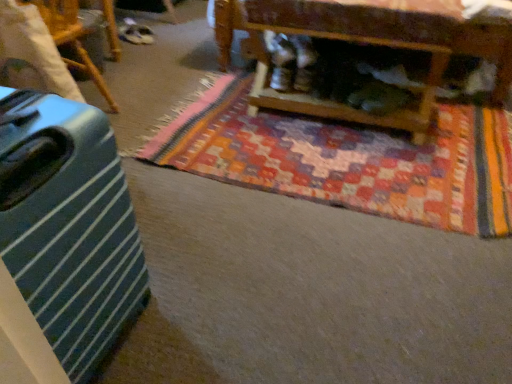
What is the approximate width of wooden coffee table at upper center, the first furniture when ordered from right to left?

wooden coffee table at upper center, the first furniture when ordered from right to left, is 16.58 inches in width.

Where is `green striped suitcase at left`? Image resolution: width=512 pixels, height=384 pixels. green striped suitcase at left is located at coordinates (69, 226).

Is multicolored woven mat at center turned away from green striped suitcase at left, arranged as the second furniture when viewed from the right?

No, green striped suitcase at left, arranged as the second furniture when viewed from the right, is not at the back of multicolored woven mat at center.

What are the coordinates of `mat located on the right of green striped suitcase at left, arranged as the second furniture when viewed from the right` in the screenshot? It's located at (348, 159).

From the picture: Is multicolored woven mat at center bigger than green striped suitcase at left, which appears as the first furniture when viewed from the left?

Correct, multicolored woven mat at center is larger in size than green striped suitcase at left, which appears as the first furniture when viewed from the left.

From a real-world perspective, who is located lower, green striped suitcase at left, arranged as the second furniture when viewed from the right, or wooden coffee table at upper center, the first furniture when ordered from right to left?

wooden coffee table at upper center, the first furniture when ordered from right to left, from a real-world perspective.

From the image's perspective, between green striped suitcase at left, arranged as the second furniture when viewed from the right, and wooden coffee table at upper center, the first furniture when ordered from right to left, who is located below?

green striped suitcase at left, arranged as the second furniture when viewed from the right, from the image's perspective.

Does green striped suitcase at left, which appears as the first furniture when viewed from the left, have a lesser width compared to wooden coffee table at upper center, the first furniture when ordered from right to left?

Correct, the width of green striped suitcase at left, which appears as the first furniture when viewed from the left, is less than that of wooden coffee table at upper center, the first furniture when ordered from right to left.

Between point (64, 6) and point (356, 35), which one is positioned in front?

The point (356, 35) is closer.

From a real-world perspective, relative to multicolored woven mat at center, is green striped suitcase at left, which appears as the first furniture when viewed from the left, vertically above or below?

From a real-world perspective, green striped suitcase at left, which appears as the first furniture when viewed from the left, is physically above multicolored woven mat at center.

Can you tell me how much green striped suitcase at left, arranged as the second furniture when viewed from the right, and multicolored woven mat at center differ in facing direction?

17.5 degrees.

From the image's perspective, would you say green striped suitcase at left, arranged as the second furniture when viewed from the right, is shown under multicolored woven mat at center?

No, from the image's perspective, green striped suitcase at left, arranged as the second furniture when viewed from the right, is not below multicolored woven mat at center.

Would you consider green striped suitcase at left to be distant from wooden coffee table at upper center, the first furniture when ordered from right to left?

green striped suitcase at left is far away from wooden coffee table at upper center, the first furniture when ordered from right to left.

Which object is thinner, green striped suitcase at left or wooden coffee table at upper center, the 2th furniture when ordered from left to right?

wooden coffee table at upper center, the 2th furniture when ordered from left to right, is thinner.

Between point (119, 302) and point (334, 107), which one is positioned in front?

The point (119, 302) is closer.

How much distance is there between green striped suitcase at left and wooden coffee table at upper center, the 2th furniture when ordered from left to right?

They are 1.29 meters apart.

Is wooden coffee table at upper center, the 2th furniture when ordered from left to right, at the back of multicolored woven mat at center?

That's right, multicolored woven mat at center is facing away from wooden coffee table at upper center, the 2th furniture when ordered from left to right.

What's the angular difference between multicolored woven mat at center and wooden coffee table at upper center, the 2th furniture when ordered from left to right,'s facing directions?

They differ by 0.276 degrees in their facing directions.

From a real-world perspective, relative to wooden coffee table at upper center, the 2th furniture when ordered from left to right, is multicolored woven mat at center vertically above or below?

multicolored woven mat at center is below wooden coffee table at upper center, the 2th furniture when ordered from left to right.

Which object is positioned more to the right, multicolored woven mat at center or wooden coffee table at upper center, the first furniture when ordered from right to left?

From the viewer's perspective, multicolored woven mat at center appears more on the right side.

Could you tell me if green striped suitcase at left, which appears as the first furniture when viewed from the left, is turned towards green striped suitcase at left?

Yes.

Is green striped suitcase at left, arranged as the second furniture when viewed from the right, next to green striped suitcase at left and touching it?

There is a gap between green striped suitcase at left, arranged as the second furniture when viewed from the right, and green striped suitcase at left.

Is green striped suitcase at left, arranged as the second furniture when viewed from the right, positioned behind green striped suitcase at left?

Yes, the depth of green striped suitcase at left, arranged as the second furniture when viewed from the right, is greater than that of green striped suitcase at left.

Does wooden coffee table at upper center, the first furniture when ordered from right to left, touch green striped suitcase at left?

No, wooden coffee table at upper center, the first furniture when ordered from right to left, is not in contact with green striped suitcase at left.

Would you say wooden coffee table at upper center, the 2th furniture when ordered from left to right, is inside or outside green striped suitcase at left?

wooden coffee table at upper center, the 2th furniture when ordered from left to right, is located beyond the bounds of green striped suitcase at left.

You are a GUI agent. You are given a task and a screenshot of the screen. Output one action in this format:
    pyautogui.click(x=<x>, y=<y>)
    Task: Click on the furniture that is under the green striped suitcase at left (from a real-world perspective)
    Image resolution: width=512 pixels, height=384 pixels.
    Given the screenshot: What is the action you would take?
    pyautogui.click(x=365, y=42)

How different are the orientations of wooden coffee table at upper center, the first furniture when ordered from right to left, and green striped suitcase at left in degrees?

The angular difference between wooden coffee table at upper center, the first furniture when ordered from right to left, and green striped suitcase at left is 179 degrees.

Identify the location of furniture in front of the multicolored woven mat at center. (71, 39).

Find the location of `furniture above the green striped suitcase at left, arranged as the second furniture when viewed from the right (from the image's perspective)`. furniture above the green striped suitcase at left, arranged as the second furniture when viewed from the right (from the image's perspective) is located at coordinates (365, 42).

When comparing their distances from green striped suitcase at left, does green striped suitcase at left, which appears as the first furniture when viewed from the left, or multicolored woven mat at center seem further?

green striped suitcase at left, which appears as the first furniture when viewed from the left, is positioned further to the anchor green striped suitcase at left.

Which object lies further to the anchor point green striped suitcase at left, multicolored woven mat at center or wooden coffee table at upper center, the first furniture when ordered from right to left?

wooden coffee table at upper center, the first furniture when ordered from right to left, lies further to green striped suitcase at left than the other object.

Looking at the image, which one is located closer to wooden coffee table at upper center, the first furniture when ordered from right to left, green striped suitcase at left, arranged as the second furniture when viewed from the right, or green striped suitcase at left?

green striped suitcase at left, arranged as the second furniture when viewed from the right, is closer to wooden coffee table at upper center, the first furniture when ordered from right to left.

Which object lies nearer to the anchor point wooden coffee table at upper center, the first furniture when ordered from right to left, green striped suitcase at left, which appears as the first furniture when viewed from the left, or multicolored woven mat at center?

The object closer to wooden coffee table at upper center, the first furniture when ordered from right to left, is multicolored woven mat at center.

Looking at this image, which object lies nearer to the anchor point green striped suitcase at left, green striped suitcase at left, arranged as the second furniture when viewed from the right, or wooden coffee table at upper center, the 2th furniture when ordered from left to right?

green striped suitcase at left, arranged as the second furniture when viewed from the right, lies closer to green striped suitcase at left than the other object.

Estimate the real-world distances between objects in this image. Which object is closer to green striped suitcase at left, wooden coffee table at upper center, the 2th furniture when ordered from left to right, or multicolored woven mat at center?

multicolored woven mat at center is closer to green striped suitcase at left.

Looking at the image, which one is located further to multicolored woven mat at center, green striped suitcase at left, which appears as the first furniture when viewed from the left, or wooden coffee table at upper center, the 2th furniture when ordered from left to right?

green striped suitcase at left, which appears as the first furniture when viewed from the left, is positioned further to the anchor multicolored woven mat at center.

Considering their positions, is wooden coffee table at upper center, the first furniture when ordered from right to left, positioned further to green striped suitcase at left, arranged as the second furniture when viewed from the right, than multicolored woven mat at center?

wooden coffee table at upper center, the first furniture when ordered from right to left.

This screenshot has height=384, width=512. I want to click on furniture between green striped suitcase at left, which appears as the first furniture when viewed from the left, and multicolored woven mat at center, so click(365, 42).

I want to click on furniture between green striped suitcase at left and multicolored woven mat at center from left to right, so click(x=365, y=42).

Identify the location of luggage situated between green striped suitcase at left, arranged as the second furniture when viewed from the right, and wooden coffee table at upper center, the 2th furniture when ordered from left to right, from left to right. Image resolution: width=512 pixels, height=384 pixels. (69, 226).

Where is `luggage between green striped suitcase at left, arranged as the second furniture when viewed from the right, and multicolored woven mat at center from left to right`? luggage between green striped suitcase at left, arranged as the second furniture when viewed from the right, and multicolored woven mat at center from left to right is located at coordinates (69, 226).